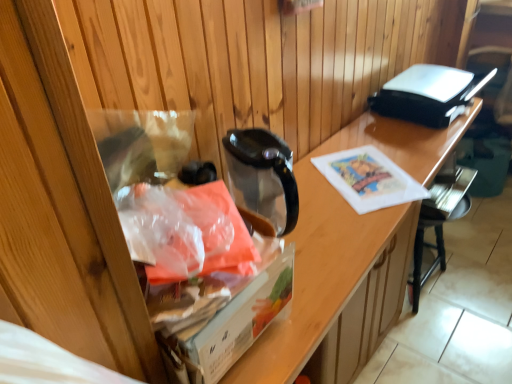
Locate an element on the screen. Image resolution: width=512 pixels, height=384 pixels. free point above transparent plastic bag at left (from a real-world perspective) is located at coordinates (365, 169).